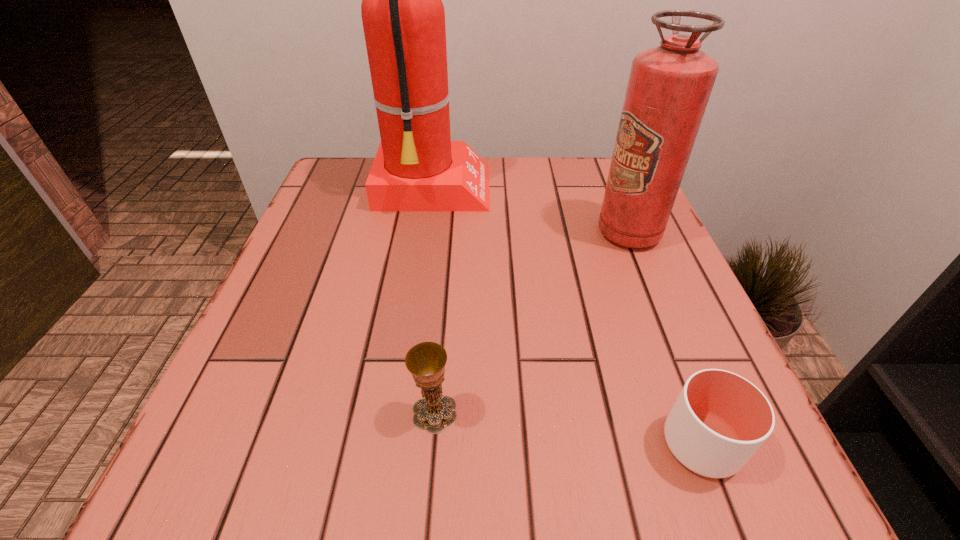
Identify the location of the left fire extinguisher. The height and width of the screenshot is (540, 960). (417, 167).

This screenshot has width=960, height=540. In order to click on the tallest object in this screenshot , I will do `click(417, 167)`.

Where is `the second tallest object`? the second tallest object is located at coordinates 669,86.

The image size is (960, 540). I want to click on the right fire extinguisher, so click(x=669, y=86).

Locate an element on the screen. The image size is (960, 540). chalice is located at coordinates (426, 361).

Where is `the shortest object`? The height and width of the screenshot is (540, 960). the shortest object is located at coordinates (720, 419).

You are a GUI agent. You are given a task and a screenshot of the screen. Output one action in this format:
    pyautogui.click(x=<x>, y=<y>)
    Task: Click on the vacant region located 0.180m on the front-facing side of the taller fire extinguisher
    This screenshot has height=540, width=960.
    Given the screenshot: What is the action you would take?
    pyautogui.click(x=564, y=191)

What are the coordinates of `free location located on the label side of the right fire extinguisher` in the screenshot? It's located at (560, 233).

The height and width of the screenshot is (540, 960). In order to click on vacant space positioned 0.230m on the label side of the right fire extinguisher in this screenshot , I will do `click(490, 233)`.

Identify the location of free space located 0.200m on the label side of the right fire extinguisher. The height and width of the screenshot is (540, 960). (504, 233).